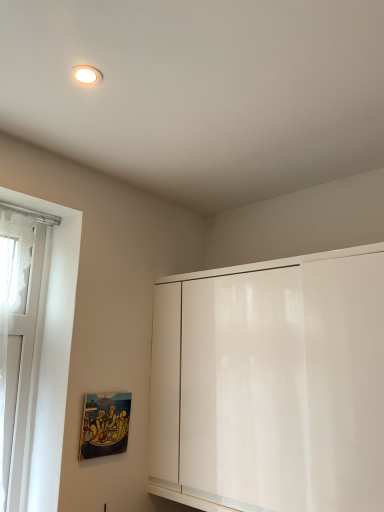
This screenshot has width=384, height=512. What do you see at coordinates (105, 425) in the screenshot?
I see `matte wooden picture frame at lower left` at bounding box center [105, 425].

Locate an element on the screen. white glossy cabinet at center is located at coordinates (271, 384).

Who is shorter, white glossy cabinet at center or white glass window at left?

With less height is white glossy cabinet at center.

This screenshot has width=384, height=512. Identify the location of cabinetry below the white glass window at left (from the image's perspective). (271, 384).

Considering the relative sizes of white glossy cabinet at center and white glass window at left in the image provided, is white glossy cabinet at center thinner than white glass window at left?

Incorrect, the width of white glossy cabinet at center is not less than that of white glass window at left.

From a real-world perspective, which is physically below, white glossy cabinet at center or white glass window at left?

white glossy cabinet at center, from a real-world perspective.

Is matte wooden picture frame at lower left to the right of white glossy cabinet at center from the viewer's perspective?

No.

Are matte wooden picture frame at lower left and white glossy cabinet at center located far from each other?

That's not correct — matte wooden picture frame at lower left is a little close to white glossy cabinet at center.

From the image's perspective, is matte wooden picture frame at lower left located above or below white glossy cabinet at center?

From the image's perspective, matte wooden picture frame at lower left appears below white glossy cabinet at center.

Which object is wider, matte wooden picture frame at lower left or white glossy cabinet at center?

With larger width is white glossy cabinet at center.

Can you confirm if white glossy cabinet at center is positioned to the right of matte wooden picture frame at lower left?

Indeed, white glossy cabinet at center is positioned on the right side of matte wooden picture frame at lower left.

Do you think white glossy cabinet at center is within matte wooden picture frame at lower left, or outside of it?

white glossy cabinet at center is spatially situated outside matte wooden picture frame at lower left.

Where is `picture frame located underneath the white glossy cabinet at center (from a real-world perspective)`? picture frame located underneath the white glossy cabinet at center (from a real-world perspective) is located at coordinates (105, 425).

Consider the image. Could you tell me if white glossy cabinet at center is facing matte wooden picture frame at lower left?

Yes.

From a real-world perspective, relative to matte wooden picture frame at lower left, is white glass window at left vertically above or below?

white glass window at left is above matte wooden picture frame at lower left.

Can you confirm if white glass window at left is bigger than matte wooden picture frame at lower left?

Yes.

Is white glass window at left inside the boundaries of matte wooden picture frame at lower left, or outside?

white glass window at left is not enclosed by matte wooden picture frame at lower left.

Measure the distance between white glass window at left and matte wooden picture frame at lower left.

white glass window at left is 22.51 centimeters away from matte wooden picture frame at lower left.

Is white glass window at left far from white glossy cabinet at center?

Actually, white glass window at left and white glossy cabinet at center are a little close together.

Does point (34, 344) come behind point (151, 465)?

No.

Is white glossy cabinet at center at the back of white glass window at left?

No, white glass window at left's orientation is not away from white glossy cabinet at center.

Who is taller, matte wooden picture frame at lower left or white glass window at left?

white glass window at left is taller.

Is the surface of matte wooden picture frame at lower left in direct contact with white glass window at left?

No, matte wooden picture frame at lower left is not in contact with white glass window at left.

How many degrees apart are the facing directions of matte wooden picture frame at lower left and white glass window at left?

The angle between the facing direction of matte wooden picture frame at lower left and the facing direction of white glass window at left is 2.04 degrees.

I want to click on picture frame on the right side of white glass window at left, so click(x=105, y=425).

This screenshot has height=512, width=384. Identify the location of window above the white glossy cabinet at center (from a real-world perspective). (44, 362).

Identify the location of cabinetry on the right of the matte wooden picture frame at lower left. The height and width of the screenshot is (512, 384). (271, 384).

Consider the image. Which object lies further to the anchor point white glass window at left, matte wooden picture frame at lower left or white glossy cabinet at center?

Among the two, white glossy cabinet at center is located further to white glass window at left.

Estimate the real-world distances between objects in this image. Which object is closer to white glossy cabinet at center, white glass window at left or matte wooden picture frame at lower left?

matte wooden picture frame at lower left lies closer to white glossy cabinet at center than the other object.

From the image, which object appears to be farther from white glossy cabinet at center, matte wooden picture frame at lower left or white glass window at left?

white glass window at left.

Looking at the image, which one is located closer to matte wooden picture frame at lower left, white glossy cabinet at center or white glass window at left?

Among the two, white glass window at left is located nearer to matte wooden picture frame at lower left.

When comparing their distances from white glass window at left, does white glossy cabinet at center or matte wooden picture frame at lower left seem closer?

matte wooden picture frame at lower left is positioned closer to the anchor white glass window at left.

Considering their positions, is white glass window at left positioned closer to matte wooden picture frame at lower left than white glossy cabinet at center?

white glass window at left is positioned closer to the anchor matte wooden picture frame at lower left.

This screenshot has height=512, width=384. Find the location of `picture frame between white glass window at left and white glossy cabinet at center from left to right`. picture frame between white glass window at left and white glossy cabinet at center from left to right is located at coordinates (105, 425).